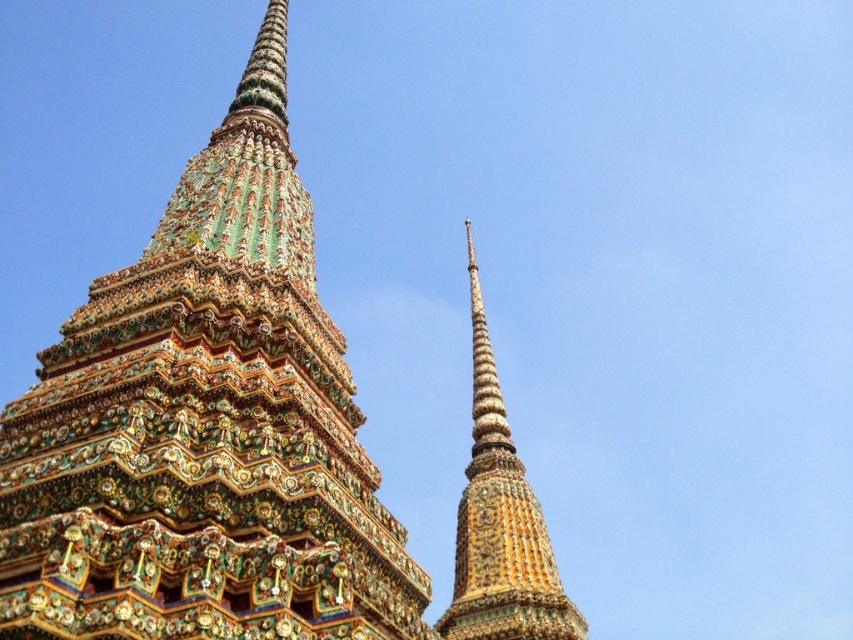
You are standing in front of a temple complex with a multicolored mosaic temple spire at center. You want to take a photo of the spire with your smartphone, which has a maximum focus range of 100 feet. Will the spire be in focus?

The multicolored mosaic temple spire at center is 110.30 feet away from the viewer. Since the smartphone has a maximum focus range of 100 feet, the spire will be out of focus.